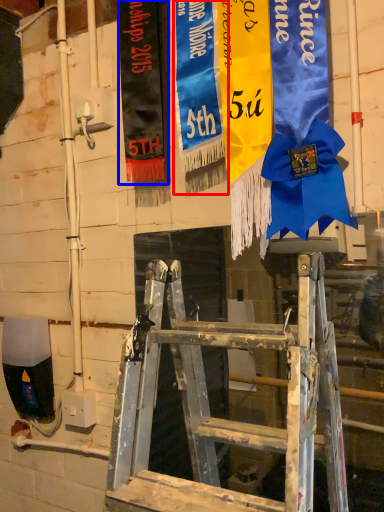
Question: Which of the following is the closest to the observer, tapestry (highlighted by a red box) or tapestry (highlighted by a blue box)?

Choices:
 (A) tapestry
 (B) tapestry

Answer: (A)